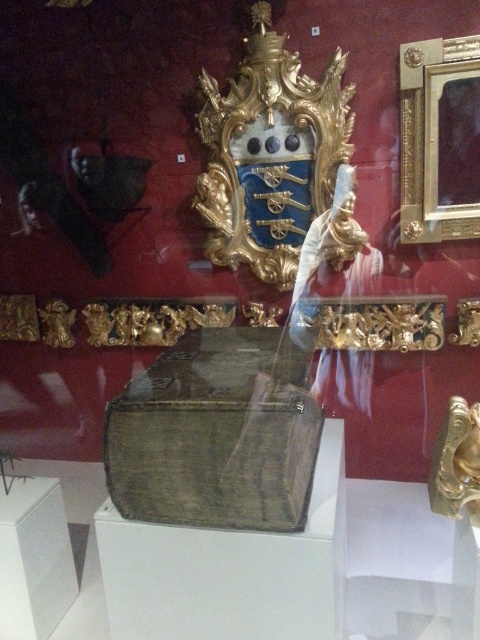
Question: Among these points, which one is nearest to the camera?

Choices:
 (A) (420, 202)
 (B) (47, 625)

Answer: (B)

Question: Among these points, which one is nearest to the camera?

Choices:
 (A) (251, 392)
 (B) (433, 195)
 (C) (21, 509)

Answer: (A)

Question: Which point appears farthest from the camera in this image?

Choices:
 (A) (15, 500)
 (B) (419, 109)

Answer: (B)

Question: Does greenish-brown leather box at center lie in front of goldmetallicpicture frame at upper right?

Choices:
 (A) no
 (B) yes

Answer: (B)

Question: Can you confirm if greenish-brown leather box at center is positioned to the right of goldmetallicpicture frame at upper right?

Choices:
 (A) no
 (B) yes

Answer: (A)

Question: Can you confirm if greenish-brown leather box at center is wider than goldmetallicpicture frame at upper right?

Choices:
 (A) yes
 (B) no

Answer: (A)